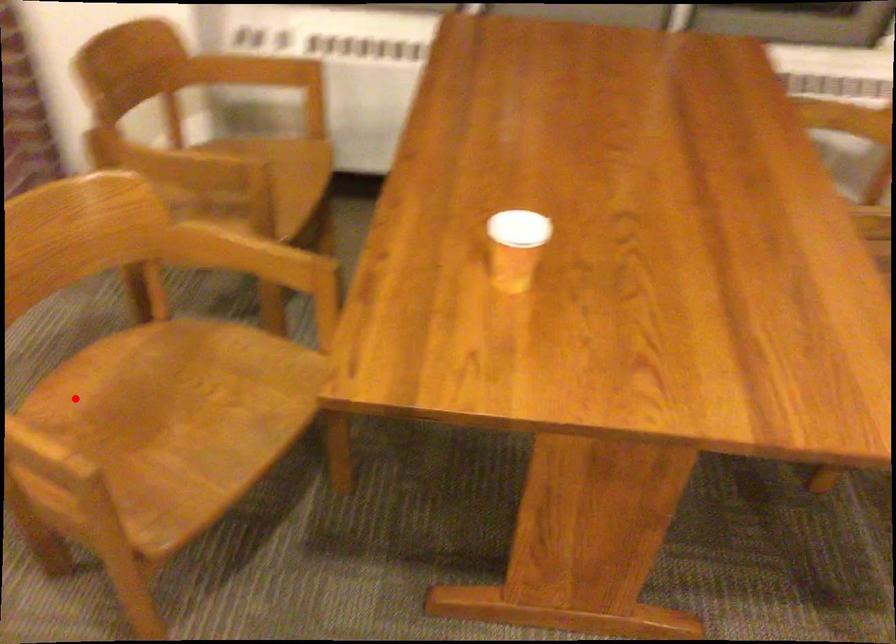
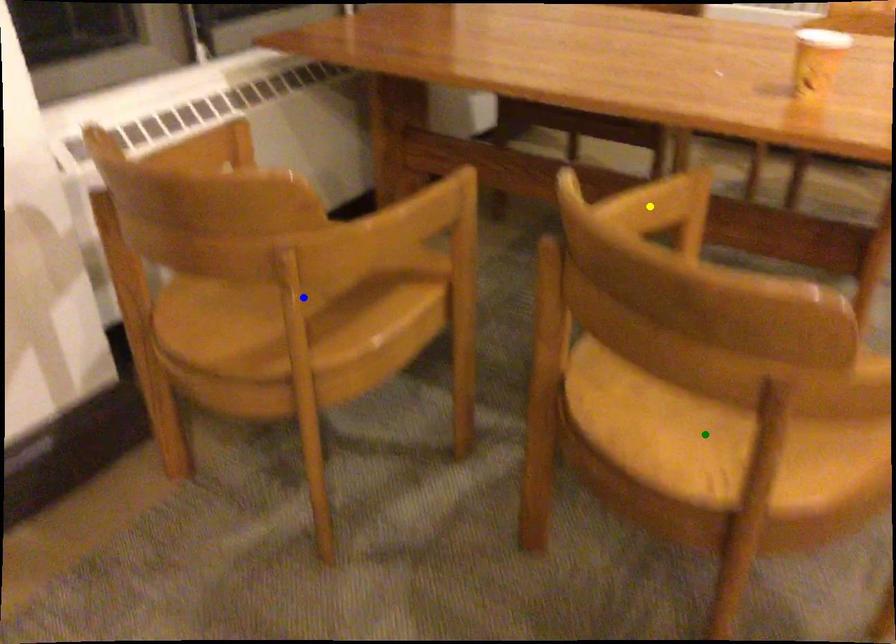
Question: I am providing you with two images of the same scene from different viewpoints. A red point is marked on the first image. You are given multiple points on the second image. Which spot in image 2 lines up with the point in image 1?

Choices:
 (A) blue point
 (B) yellow point
 (C) green point

Answer: (C)